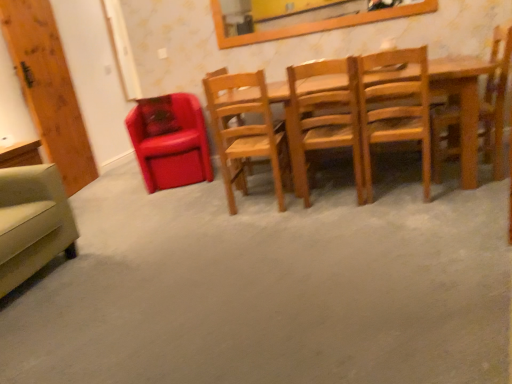
Find the location of a particular element. free area in between beige fabric armchair at lower left, placed as the 6th chair when sorted from right to left, and wooden chair at center, marked as the 2th chair in a right-to-left arrangement is located at coordinates (187, 243).